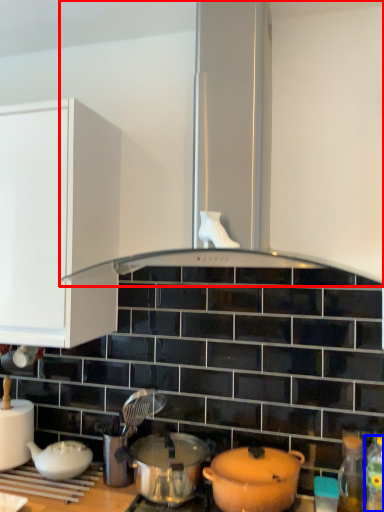
Question: Which of the following is the farthest to the observer, exhaust hood (highlighted by a red box) or bottle (highlighted by a blue box)?

Choices:
 (A) exhaust hood
 (B) bottle

Answer: (B)